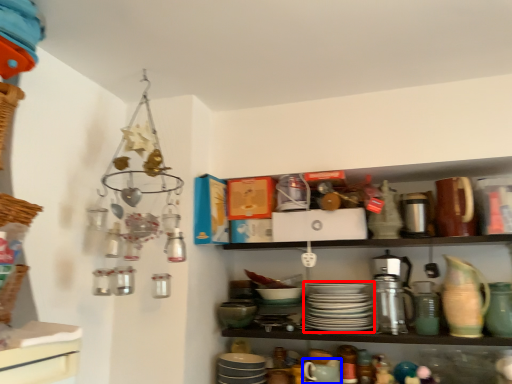
Question: Which object is closer to the camera taking this photo, tableware (highlighted by a red box) or tableware (highlighted by a blue box)?

Choices:
 (A) tableware
 (B) tableware

Answer: (B)